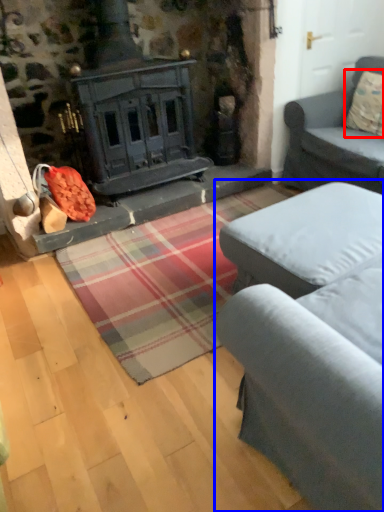
Question: Which object appears closest to the camera in this image, pillow (highlighted by a red box) or studio couch (highlighted by a blue box)?

Choices:
 (A) pillow
 (B) studio couch

Answer: (B)